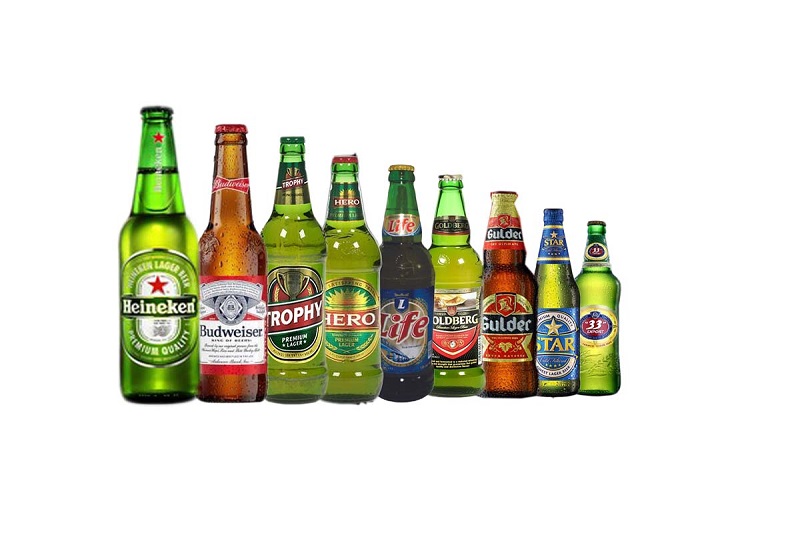
Locate an element on the screen. The image size is (800, 533). bottles is located at coordinates (168, 296), (238, 308), (288, 297), (356, 305), (412, 313), (450, 311), (504, 325), (556, 333), (592, 335).